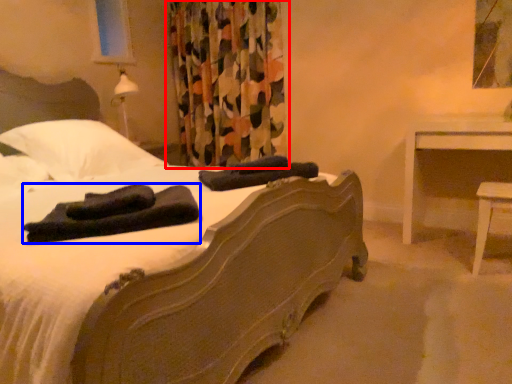
Question: Which object is further to the camera taking this photo, curtain (highlighted by a red box) or material (highlighted by a blue box)?

Choices:
 (A) curtain
 (B) material

Answer: (A)